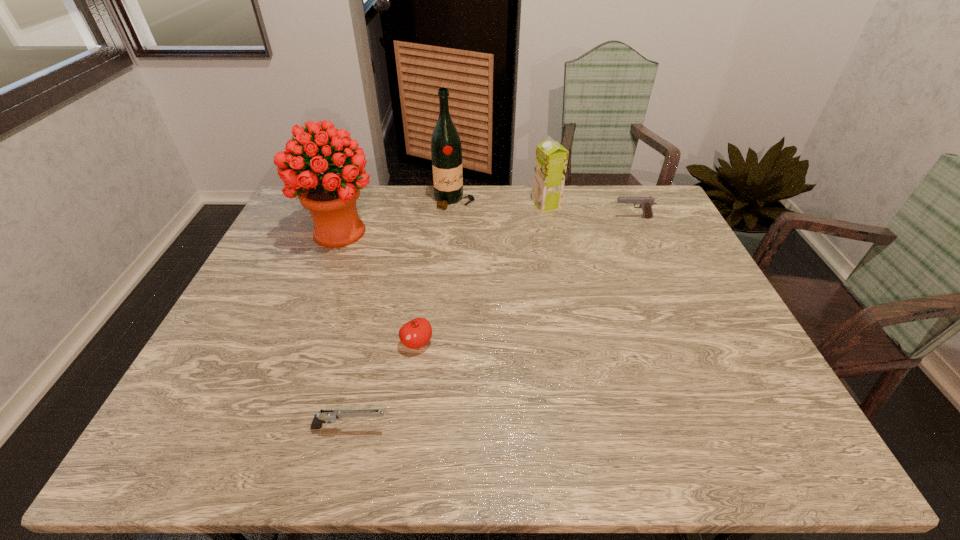
In order to click on pistol that is at the far edge in this screenshot , I will do `click(646, 203)`.

Locate an element on the screen. object at the near edge is located at coordinates (324, 415).

This screenshot has width=960, height=540. What are the coordinates of `object that is at the left edge` in the screenshot? It's located at (331, 197).

Where is `object situated at the right edge`? The height and width of the screenshot is (540, 960). object situated at the right edge is located at coordinates (646, 203).

Locate an element on the screen. object that is at the far left corner is located at coordinates (331, 197).

I want to click on object at the far right corner, so click(646, 203).

Where is `free spot at the far edge of the desktop`? free spot at the far edge of the desktop is located at coordinates (585, 209).

At what (x,y) coordinates should I click in order to perform the action: click on vacant space at the near edge. Please return your answer as a coordinate pair (x, y). The height and width of the screenshot is (540, 960). Looking at the image, I should click on (380, 427).

In the image, there is a desktop. Where is `vacant space at the right edge`? vacant space at the right edge is located at coordinates (718, 340).

Where is `vacant space at the far right corner`? This screenshot has height=540, width=960. vacant space at the far right corner is located at coordinates (650, 221).